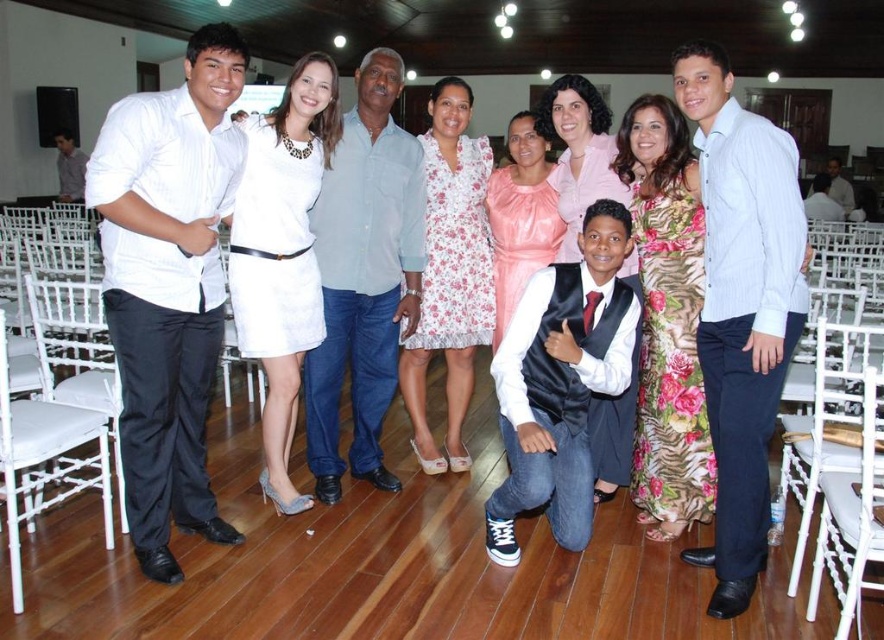
You are taking a photo of the group and want to focus on two specific points in the image, point (181, 403) and point (237, 314). Which point is closer to the camera?

Point (181, 403) is closer to the camera than point (237, 314).

You are a photographer who wants to ensure all subjects are visible in the photo. Considering the white satin vest at center and the pink satin dress at center, which one might require more space to avoid being cropped out?

The white satin vest at center has a larger size compared to the pink satin dress at center, so it might require more space to avoid being cropped out.